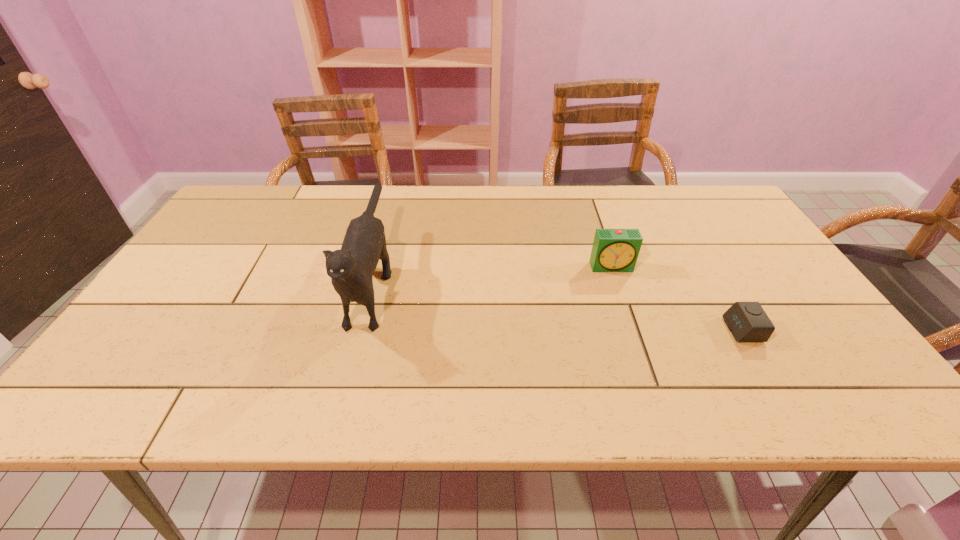
What are the coordinates of `free point between the shorter alarm clock and the second tallest object` in the screenshot? It's located at (678, 298).

Find the location of `free point between the leftmost object and the shorter alarm clock`. free point between the leftmost object and the shorter alarm clock is located at coordinates (558, 305).

Identify the location of blank region between the leftmost object and the shorter alarm clock. (558, 305).

Where is `vacant area between the farther alarm clock and the right alarm clock`? The image size is (960, 540). vacant area between the farther alarm clock and the right alarm clock is located at coordinates (678, 298).

In order to click on empty space between the rightmost object and the leftmost object in this screenshot , I will do `click(558, 305)`.

Locate an element on the screen. This screenshot has width=960, height=540. vacant area between the right alarm clock and the second object from right to left is located at coordinates (678, 298).

Where is `vacant area that lies between the shortest object and the left alarm clock`? This screenshot has width=960, height=540. vacant area that lies between the shortest object and the left alarm clock is located at coordinates (678, 298).

Where is `the closest object relative to the farther alarm clock`? the closest object relative to the farther alarm clock is located at coordinates (747, 321).

Identify which object is the second nearest to the cat. Please provide its 2D coordinates. Your answer should be formatted as a tuple, i.e. [(x, y)], where the tuple contains the x and y coordinates of a point satisfying the conditions above.

[(747, 321)]